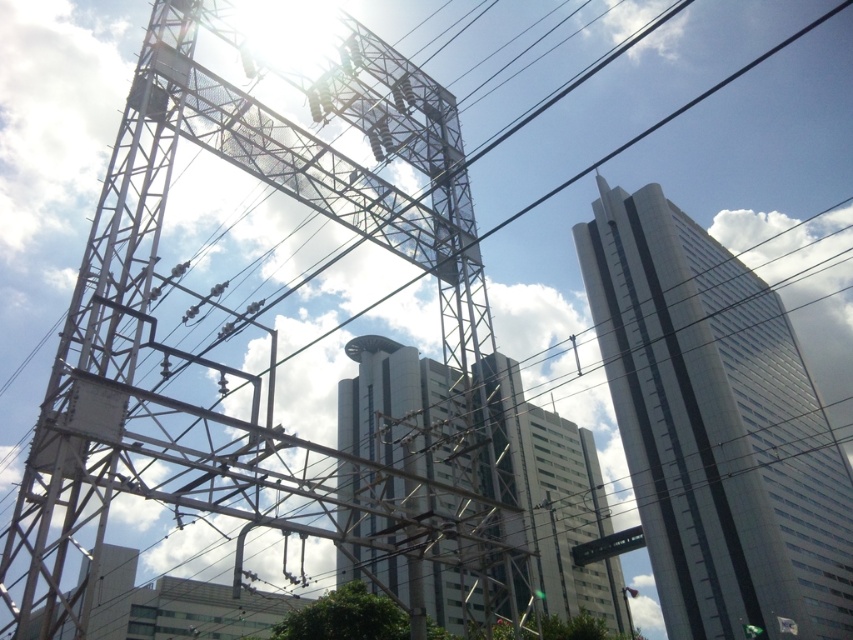
Question: Considering the real-world distances, which object is farthest from the silver metallic skyscraper at upper right?

Choices:
 (A) glassy white skyscraper at center
 (B) metallic structure at left

Answer: (B)

Question: Which object is farther from the camera taking this photo?

Choices:
 (A) silver metallic skyscraper at upper right
 (B) metallic structure at left

Answer: (A)

Question: Is silver metallic skyscraper at upper right thinner than glassy white skyscraper at center?

Choices:
 (A) no
 (B) yes

Answer: (A)

Question: Which object is positioned farthest from the glassy white skyscraper at center?

Choices:
 (A) metallic structure at left
 (B) silver metallic skyscraper at upper right

Answer: (B)

Question: Is silver metallic skyscraper at upper right to the right of glassy white skyscraper at center from the viewer's perspective?

Choices:
 (A) yes
 (B) no

Answer: (A)

Question: Can you confirm if silver metallic skyscraper at upper right is positioned below glassy white skyscraper at center?

Choices:
 (A) no
 (B) yes

Answer: (A)